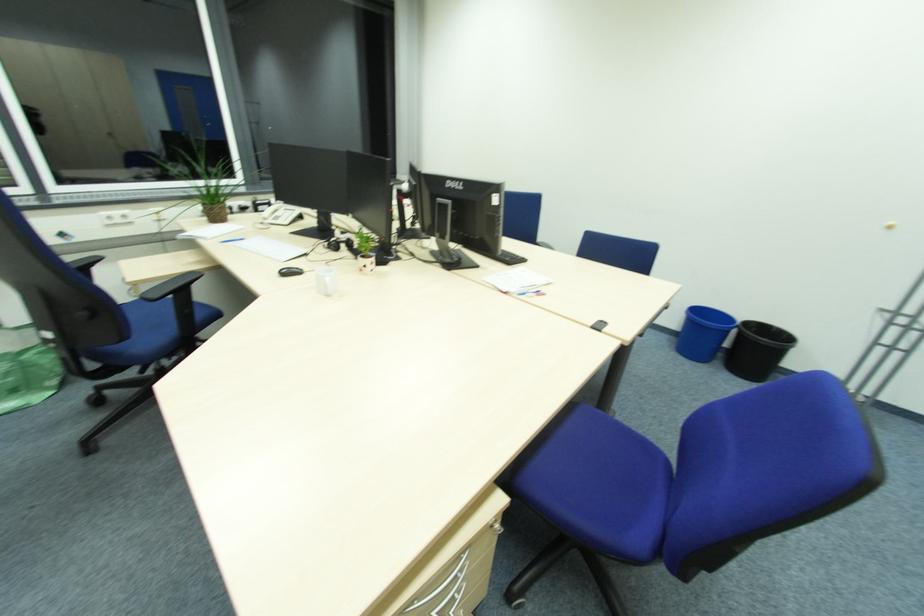
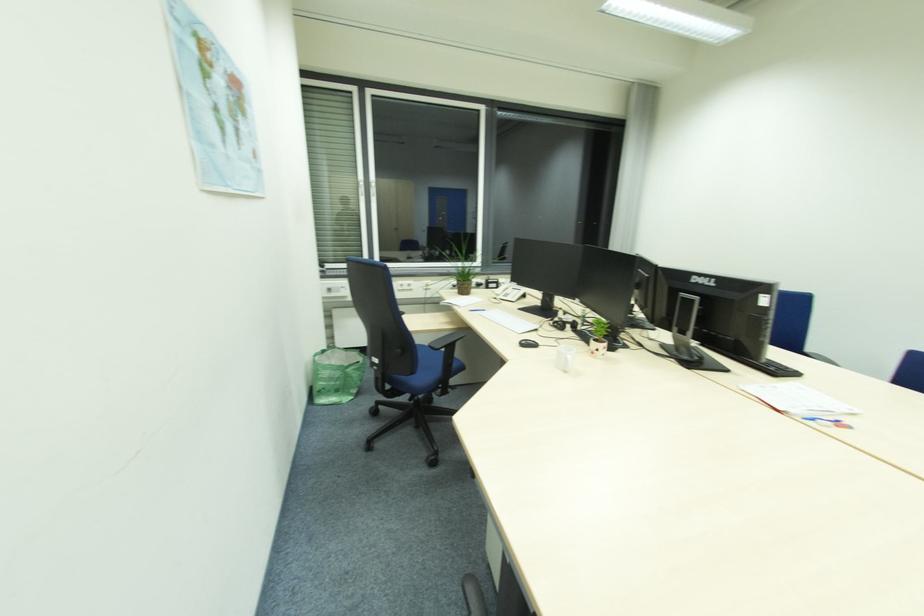
Question: The camera is either moving clockwise (left) or counter-clockwise (right) around the object. The first image is from the beginning of the video and the second image is from the end. Is the camera moving left or right when shooting the video?

Choices:
 (A) Left
 (B) Right

Answer: (B)